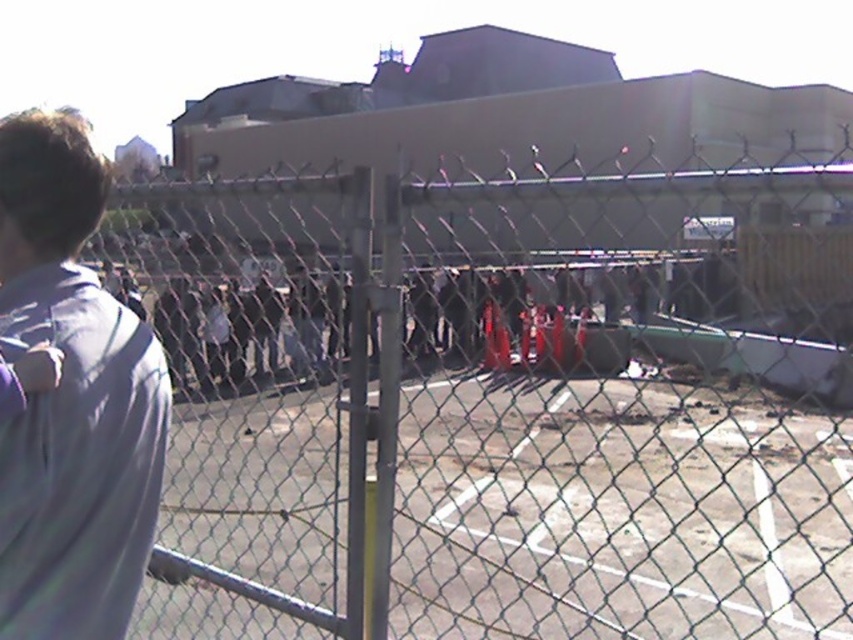
You are standing at the center of the scene and want to move towards the gray fabric shirt at left. The chain link fence at left is blocking your path. Can you walk around it to reach the shirt?

The chain link fence at left is 16.55 meters away from the gray fabric shirt at left, so you can walk around the fence to reach the shirt as the distance allows enough space to maneuver around it.

You are a photographer trying to capture a clear shot of the gray fabric shirt at left and the chain link fence at left. Based on their positions, which object is closer to the camera?

The gray fabric shirt at left is closer to the camera because the chain link fence at left is positioned on its right side, meaning it is further away.